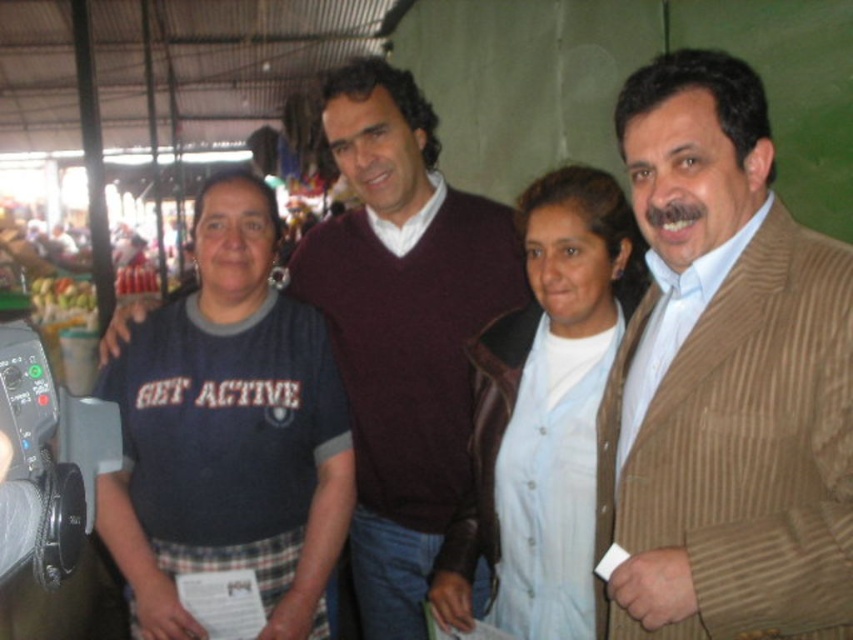
Is maroon sweater at center thinner than light blue fabric at center?

No, maroon sweater at center is not thinner than light blue fabric at center.

Does maroon sweater at center have a larger size compared to light blue fabric at center?

Indeed, maroon sweater at center has a larger size compared to light blue fabric at center.

Identify the location of maroon sweater at center. This screenshot has height=640, width=853. (403, 326).

Find the location of a particular element. This screenshot has height=640, width=853. maroon sweater at center is located at coordinates (403, 326).

Measure the distance between point (822,250) and camera.

The distance of point (822,250) from camera is 3.36 feet.

In the scene shown: Who is higher up, brown corduroy jacket at right or light blue fabric at center?

Positioned higher is brown corduroy jacket at right.

Image resolution: width=853 pixels, height=640 pixels. What do you see at coordinates (726, 381) in the screenshot?
I see `brown corduroy jacket at right` at bounding box center [726, 381].

This screenshot has width=853, height=640. Find the location of `brown corduroy jacket at right`. brown corduroy jacket at right is located at coordinates (726, 381).

Does dark blue t-shirt at left have a lesser width compared to light blue fabric at center?

No.

Between point (280, 454) and point (515, 618), which one is positioned in front?

Point (515, 618) is in front.

Does point (236, 401) come farther from viewer compared to point (468, 508)?

Yes, it is.

What are the coordinates of `dark blue t-shirt at left` in the screenshot? It's located at (230, 429).